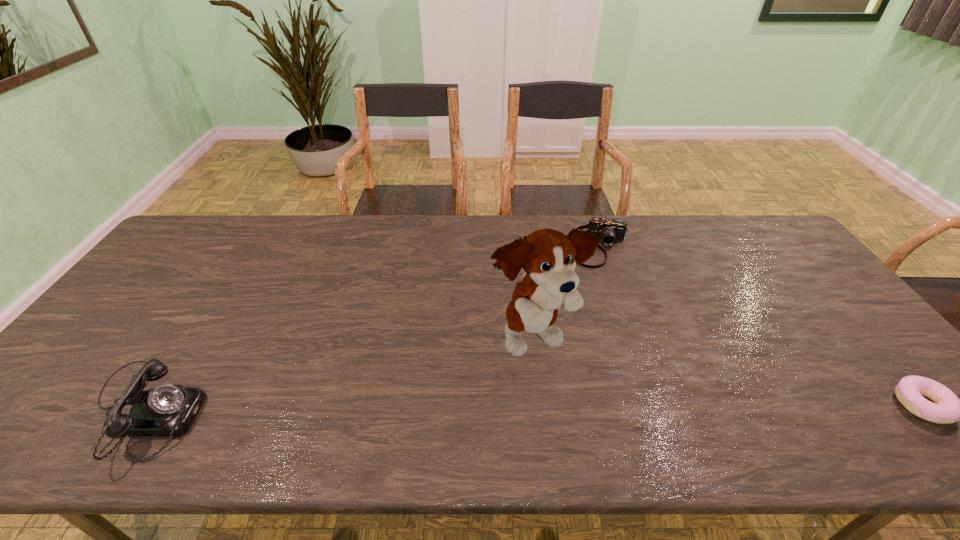
At what (x,y) coordinates should I click in order to perform the action: click on free space on the desktop that is between the leftmost object and the rightmost object and is positioned on the front-facing side of the farthest object. Please return your answer as a coordinate pair (x, y). The image size is (960, 540). Looking at the image, I should click on (575, 408).

Find the location of a particular element. The width and height of the screenshot is (960, 540). vacant space on the desktop that is between the telephone and the doughnut and is positioned on the face of the puppy is located at coordinates pos(610,408).